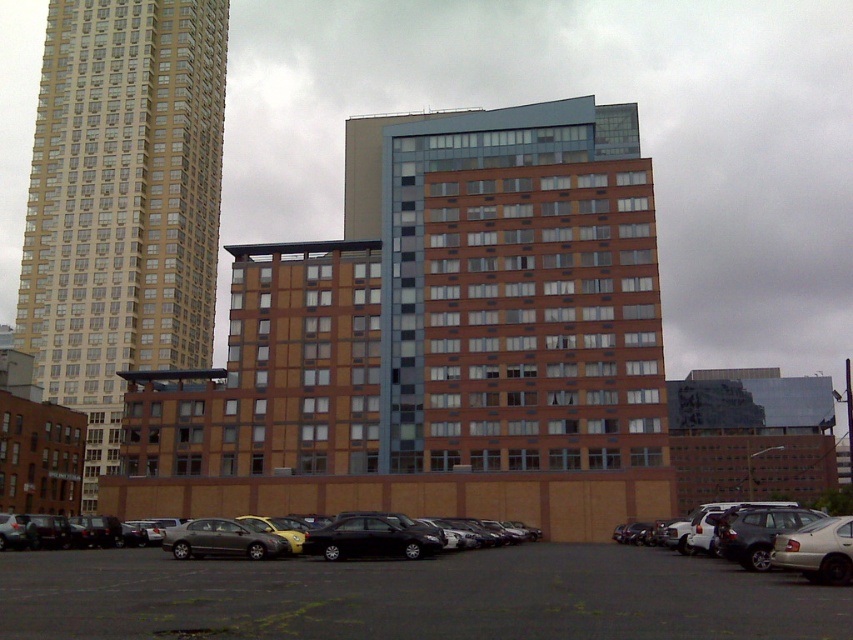
Who is positioned more to the left, black asphalt parking lot at lower center or silver metallic suv at lower right?

From the viewer's perspective, black asphalt parking lot at lower center appears more on the left side.

Which of these two, black asphalt parking lot at lower center or silver metallic suv at lower right, stands shorter?

With less height is black asphalt parking lot at lower center.

Is point (387, 561) positioned after point (730, 552)?

Yes, it is.

Locate an element on the screen. This screenshot has width=853, height=640. black asphalt parking lot at lower center is located at coordinates (412, 596).

Can you confirm if matte gold building at left is positioned to the right of black asphalt parking lot at lower center?

In fact, matte gold building at left is to the left of black asphalt parking lot at lower center.

Is matte gold building at left positioned before black asphalt parking lot at lower center?

No.

Find the location of `matte gold building at left`. matte gold building at left is located at coordinates (122, 204).

The height and width of the screenshot is (640, 853). I want to click on matte gold building at left, so click(122, 204).

Is black asphalt parking lot at lower center bigger than black matte car at lower center?

Yes.

Is black asphalt parking lot at lower center further to the viewer compared to black matte car at lower center?

No, black asphalt parking lot at lower center is in front of black matte car at lower center.

Who is more forward, (437,570) or (258,522)?

Point (437,570) is in front.

You are a GUI agent. You are given a task and a screenshot of the screen. Output one action in this format:
    pyautogui.click(x=<x>, y=<y>)
    Task: Click on the black asphalt parking lot at lower center
    
    Given the screenshot: What is the action you would take?
    pyautogui.click(x=412, y=596)